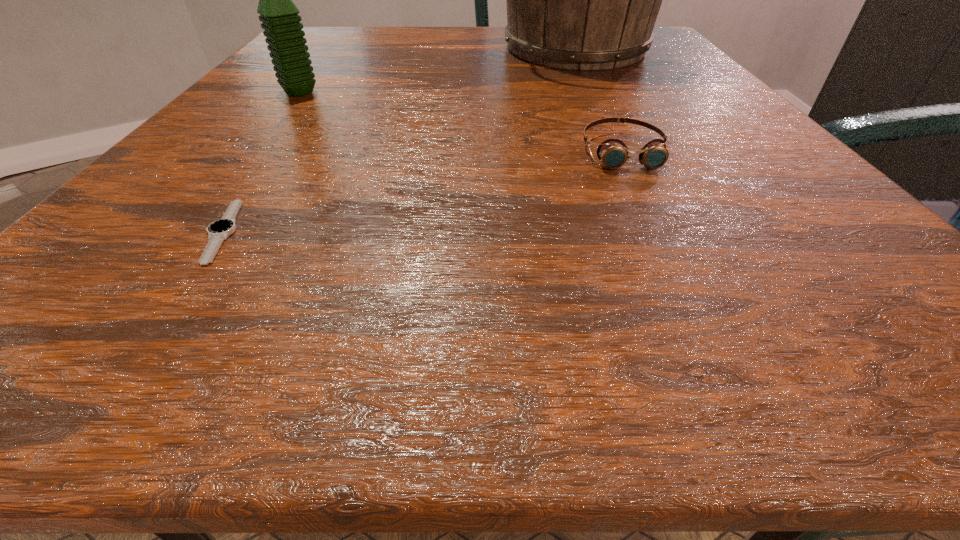
At what (x,y) coordinates should I click in order to perform the action: click on vacant area that lies between the second tallest object and the farthest object. Please return your answer as a coordinate pair (x, y). The width and height of the screenshot is (960, 540). Looking at the image, I should click on (438, 71).

Locate an element on the screen. The width and height of the screenshot is (960, 540). vacant space that's between the watch and the tallest object is located at coordinates (399, 140).

Where is `free space between the third farthest object and the watch`? The width and height of the screenshot is (960, 540). free space between the third farthest object and the watch is located at coordinates (422, 191).

Find the location of a particular element. Image resolution: width=960 pixels, height=540 pixels. vacant area that lies between the third farthest object and the second farthest object is located at coordinates (461, 122).

Locate which object is the second closest to the third nearest object. Please provide its 2D coordinates. Your answer should be formatted as a tuple, i.e. [(x, y)], where the tuple contains the x and y coordinates of a point satisfying the conditions above.

[(218, 231)]

Find the location of `the third closest object to the water bottle`. the third closest object to the water bottle is located at coordinates coord(613,153).